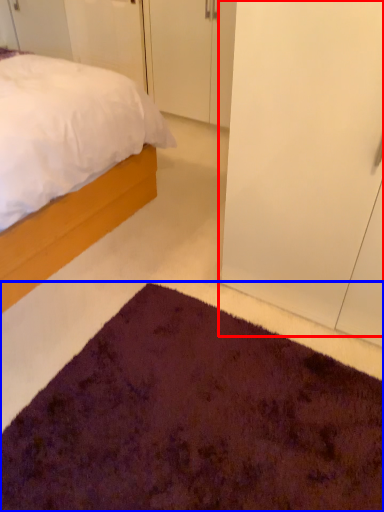
Question: Among these objects, which one is farthest to the camera, glass door (highlighted by a red box) or doormat (highlighted by a blue box)?

Choices:
 (A) glass door
 (B) doormat

Answer: (A)